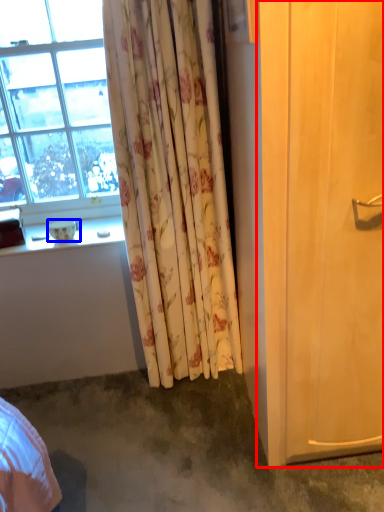
Question: Which point is closer to the camera, screen door (highlighted by a red box) or bowl (highlighted by a blue box)?

Choices:
 (A) screen door
 (B) bowl

Answer: (A)